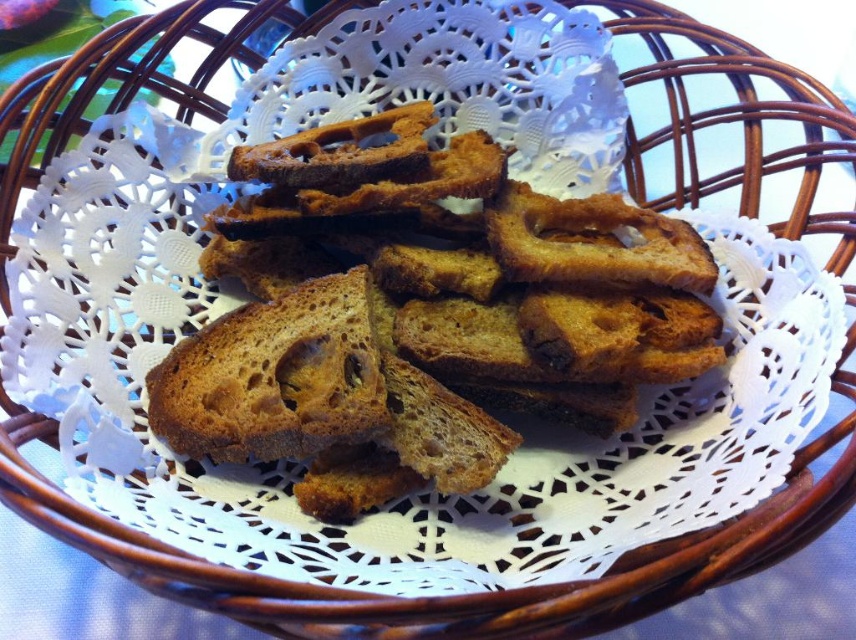
Question: Which point is closer to the camera taking this photo?

Choices:
 (A) (438, 349)
 (B) (220, 371)

Answer: (B)

Question: From the image, what is the correct spatial relationship of brown crumbly bread at center in relation to dark brown crumbly bread at center?

Choices:
 (A) right
 (B) left

Answer: (A)

Question: Does brown crumbly bread at center have a lesser width compared to dark brown crumbly bread at center?

Choices:
 (A) yes
 (B) no

Answer: (B)

Question: Which object is farther from the camera taking this photo?

Choices:
 (A) brown crumbly bread at center
 (B) dark brown crumbly bread at center

Answer: (B)

Question: Can you confirm if brown crumbly bread at center is positioned below dark brown crumbly bread at center?

Choices:
 (A) yes
 (B) no

Answer: (B)